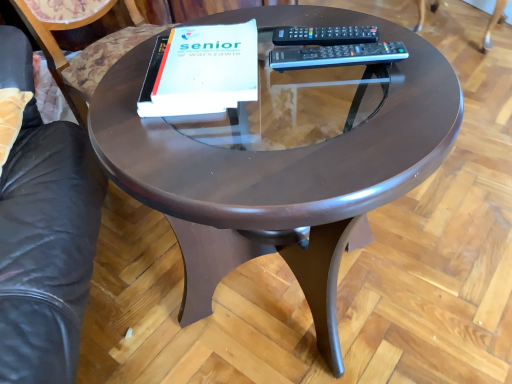
In order to click on vacant space that is to the left of white matte paper at center in this screenshot , I will do `click(122, 90)`.